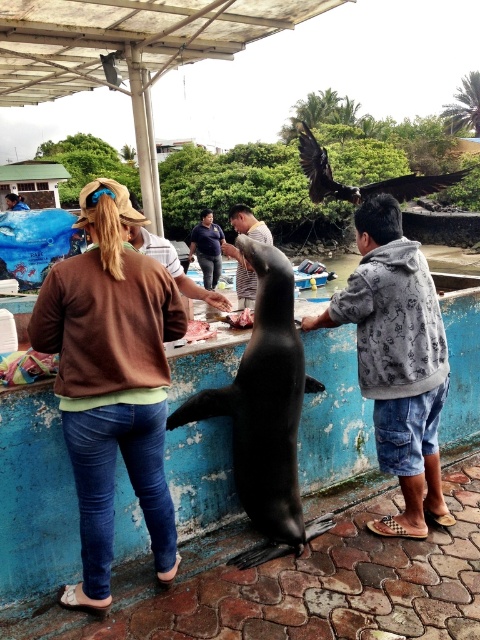
You are a photographer trying to capture a photo of the striped shirt at center and the brown cotton sweater at upper left. Which object should you focus on first if you want to include both in your frame without moving the camera?

You should focus on the striped shirt at center first because the brown cotton sweater at upper left is to the left of striped shirt at center, so by centering the striped shirt, the sweater will naturally be included on the left side of the frame.

You are a fashion designer analyzing the clothing items in the image. Which clothing item, the brown cotton sweater at upper left or the striped shirt at center, is narrower?

The brown cotton sweater at upper left has a lesser width compared to striped shirt at center, so the brown cotton sweater at upper left is narrower.

Based on the photo, what is the coordinate of the dark blue shirt at center?

The dark blue shirt at center is located at coordinate point (x=206, y=248).